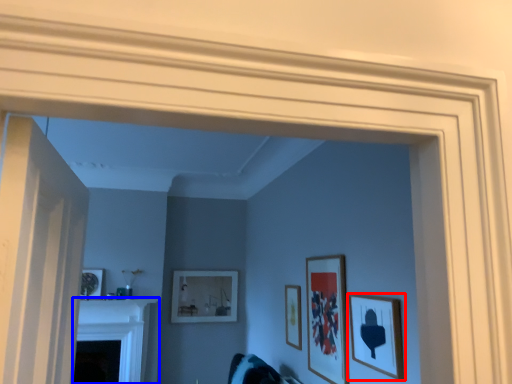
Question: Which object is further to the camera taking this photo, picture frame (highlighted by a red box) or fireplace (highlighted by a blue box)?

Choices:
 (A) picture frame
 (B) fireplace

Answer: (B)